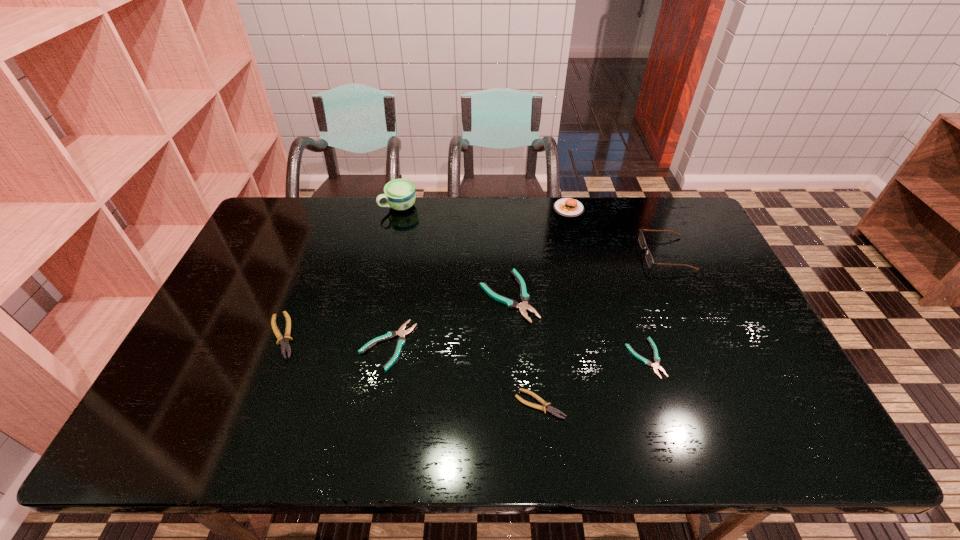
The width and height of the screenshot is (960, 540). What are the coordinates of `free spot between the tallest object and the food` in the screenshot? It's located at (484, 208).

Point out which object is positioned as the third nearest to the farther yellow pliers. Please provide its 2D coordinates. Your answer should be formatted as a tuple, i.e. [(x, y)], where the tuple contains the x and y coordinates of a point satisfying the conditions above.

[(524, 297)]

Identify which object is located as the second nearest to the cup. Please provide its 2D coordinates. Your answer should be formatted as a tuple, i.e. [(x, y)], where the tuple contains the x and y coordinates of a point satisfying the conditions above.

[(285, 345)]

I want to click on the closest pliers to the shortest pliers, so click(549, 409).

At what (x,y) coordinates should I click in order to perform the action: click on pliers identified as the fourth closest to the bigger yellow pliers. Please return your answer as a coordinate pair (x, y). This screenshot has height=540, width=960. Looking at the image, I should click on [655, 365].

Where is `the closest teal pliers to the seventh object from left to right`? This screenshot has height=540, width=960. the closest teal pliers to the seventh object from left to right is located at coordinates (524, 297).

Identify which teal pliers is located as the third nearest to the leftmost pliers. Please provide its 2D coordinates. Your answer should be formatted as a tuple, i.e. [(x, y)], where the tuple contains the x and y coordinates of a point satisfying the conditions above.

[(655, 365)]

Identify the location of vacant region that satisfies the following two spatial constraints: 1. on the front-facing side of the rightmost object; 2. on the front side of the farther yellow pliers. (703, 335).

Find the location of `free point that satisfies the following two spatial constraints: 1. on the front side of the second teal pliers from left to right; 2. on the right side of the tallest object`. free point that satisfies the following two spatial constraints: 1. on the front side of the second teal pliers from left to right; 2. on the right side of the tallest object is located at coordinates (379, 296).

Locate an element on the screen. vacant space that satisfies the following two spatial constraints: 1. on the back side of the biggest teal pliers; 2. on the right side of the bigger yellow pliers is located at coordinates click(x=298, y=296).